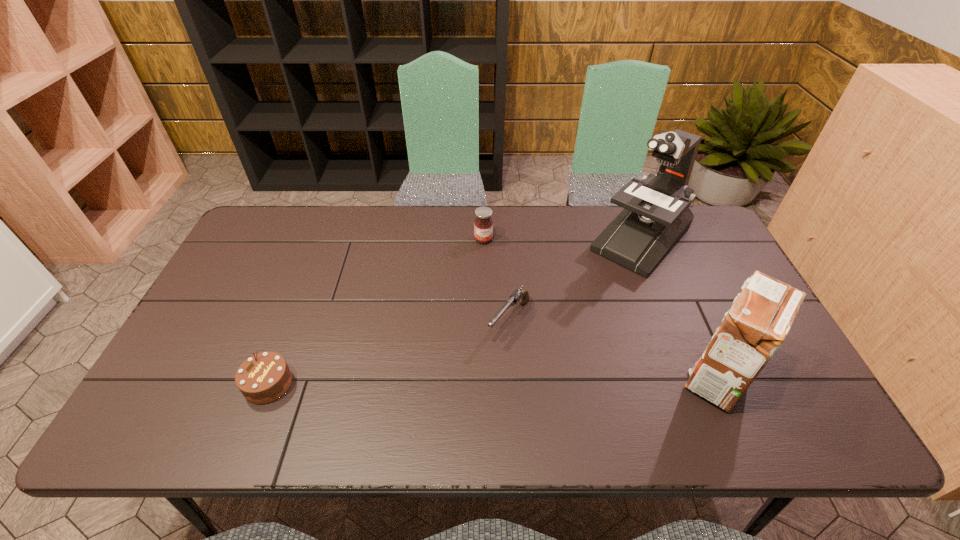
The height and width of the screenshot is (540, 960). In order to click on vacant area situated on the label side of the jam in this screenshot , I will do `click(492, 276)`.

You are a GUI agent. You are given a task and a screenshot of the screen. Output one action in this format:
    pyautogui.click(x=<x>, y=<y>)
    Task: Click on the free region located on the label side of the jam
    The image size is (960, 540).
    Given the screenshot: What is the action you would take?
    pyautogui.click(x=488, y=256)

The height and width of the screenshot is (540, 960). I want to click on vacant space located aiming along the barrel of the third nearest object, so click(467, 380).

Image resolution: width=960 pixels, height=540 pixels. In order to click on free location located aiming along the barrel of the third nearest object in this screenshot , I will do `click(449, 402)`.

This screenshot has width=960, height=540. I want to click on vacant space situated 0.200m aiming along the barrel of the third nearest object, so click(451, 399).

Identify the location of free location located 0.210m through the eyepieces of the tallest object. The height and width of the screenshot is (540, 960). (577, 308).

Identify the location of vacant space located 0.330m through the eyepieces of the tallest object. (553, 334).

Where is `free region located through the eyepieces of the tallest object`? The height and width of the screenshot is (540, 960). free region located through the eyepieces of the tallest object is located at coordinates (544, 343).

Where is `jam that is at the far edge`? The width and height of the screenshot is (960, 540). jam that is at the far edge is located at coordinates (483, 225).

Locate an element on the screen. This screenshot has width=960, height=540. microscope located at the far edge is located at coordinates (656, 214).